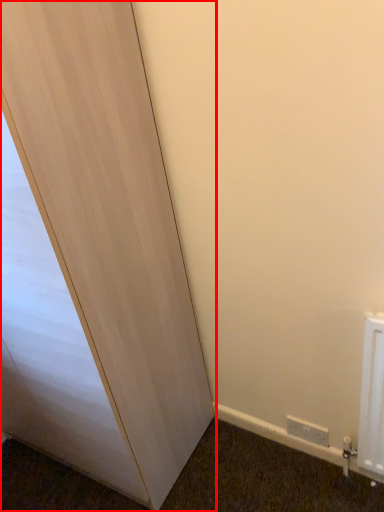
Question: From the image's perspective, where is door (annotated by the red box) located relative to electric outlet?

Choices:
 (A) above
 (B) below

Answer: (A)